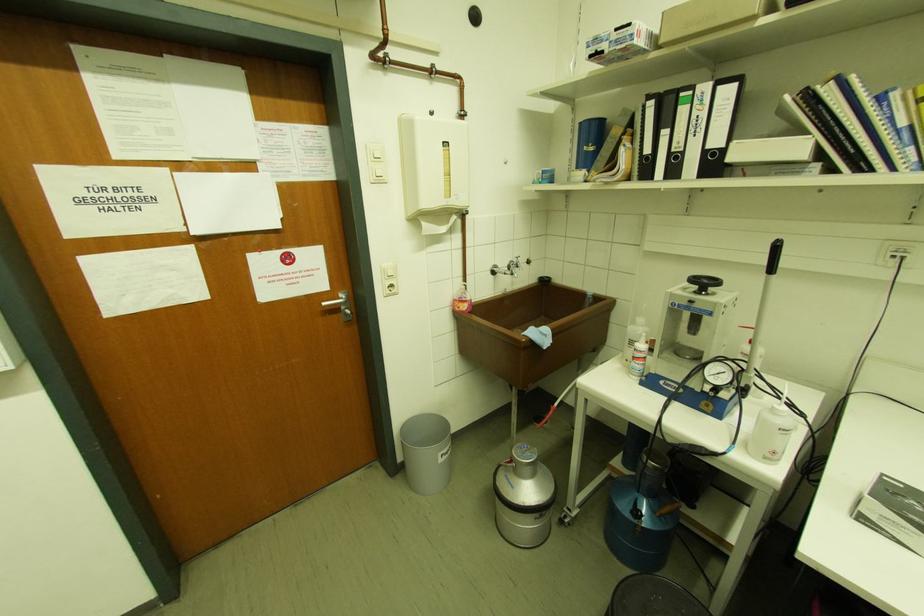
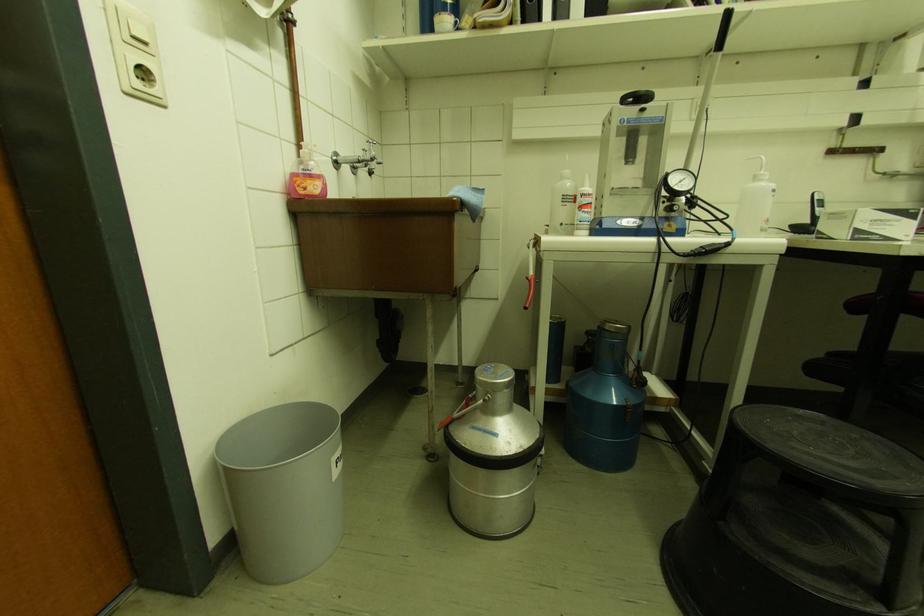
The point at (446,453) is marked in the first image. Where is the corresponding point in the second image?

(341, 455)